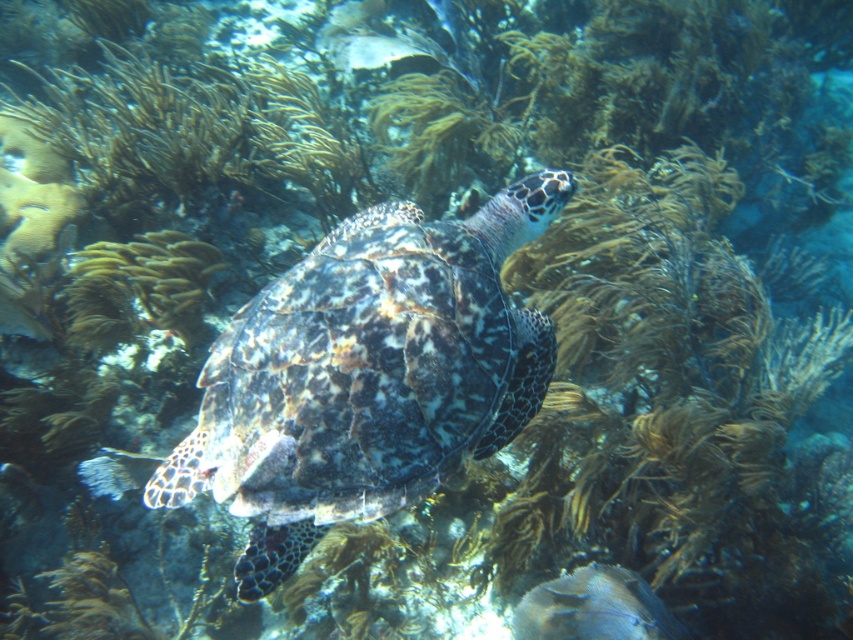
Question: Observing the image, what is the correct spatial positioning of speckled shell turtle at center in reference to brown textured coral at center?

Choices:
 (A) right
 (B) left

Answer: (A)

Question: Which of the following is the farthest from the observer?

Choices:
 (A) speckled shell turtle at center
 (B) brown textured coral at center

Answer: (B)

Question: Which point is farther from the camera taking this photo?

Choices:
 (A) (190, 256)
 (B) (329, 250)

Answer: (A)

Question: Is speckled shell turtle at center to the right of brown textured coral at center from the viewer's perspective?

Choices:
 (A) no
 (B) yes

Answer: (B)

Question: Is speckled shell turtle at center wider than brown textured coral at center?

Choices:
 (A) yes
 (B) no

Answer: (A)